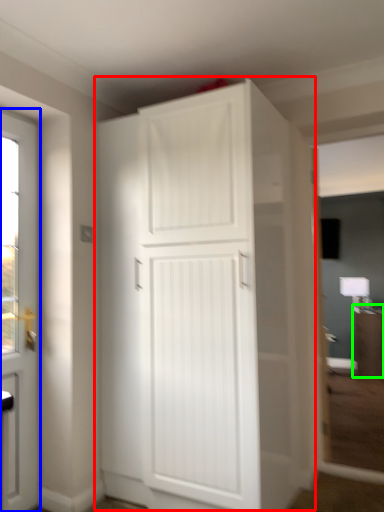
Question: Estimate the real-world distances between objects in this image. Which object is closer to cupboard (highlighted by a red box), door (highlighted by a blue box) or cabinetry (highlighted by a green box)?

Choices:
 (A) door
 (B) cabinetry

Answer: (A)